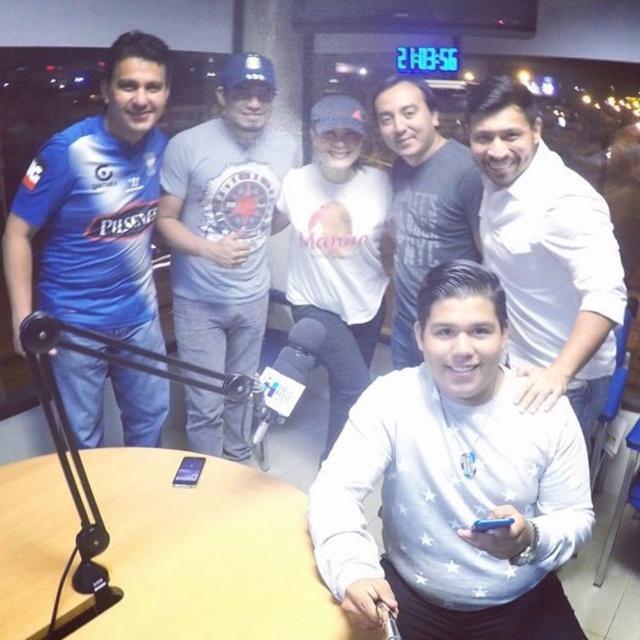
Is matte blue jersey at left positioned at the back of gray cotton t-shirt at center?

No, it is in front of gray cotton t-shirt at center.

Which is below, matte blue jersey at left or gray cotton t-shirt at center?

Positioned lower is gray cotton t-shirt at center.

Between point (72, 320) and point (237, 304), which one is positioned in front?

Point (72, 320) is more forward.

Locate an element on the screen. This screenshot has height=640, width=640. matte blue jersey at left is located at coordinates (97, 205).

Who is positioned more to the left, gray cotton t-shirt at center or white matte shirt at center?

gray cotton t-shirt at center

Is gray cotton t-shirt at center closer to camera compared to white matte shirt at center?

Yes, it is in front of white matte shirt at center.

Is point (244, 428) positioned after point (372, 173)?

Yes, it is behind point (372, 173).

What are the coordinates of `gray cotton t-shirt at center` in the screenshot? It's located at (225, 218).

Which is more to the right, white matte sweatshirt at center or white matte shirt at center?

Positioned to the right is white matte sweatshirt at center.

Who is lower down, white matte sweatshirt at center or white matte shirt at center?

white matte sweatshirt at center is below.

At what (x,y) coordinates should I click in order to perform the action: click on white matte sweatshirt at center. Please return your answer as a coordinate pair (x, y). The image size is (640, 640). Looking at the image, I should click on (454, 484).